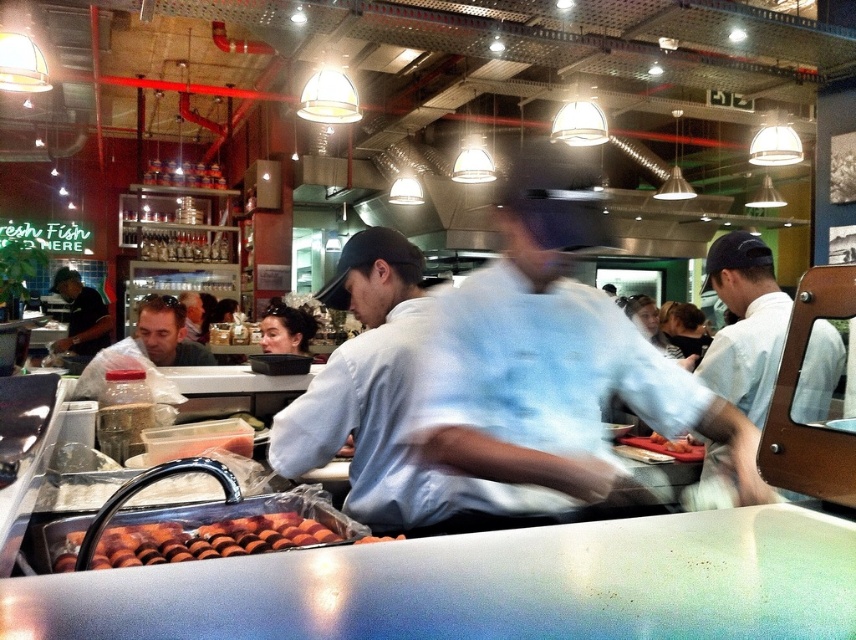
Question: Which point is farther from the camera taking this photo?

Choices:
 (A) (171, 332)
 (B) (100, 304)
 (C) (516, 356)
 (D) (54, 560)

Answer: (B)

Question: From the image, what is the correct spatial relationship of golden brown doughnuts at center in relation to matte black shirt at center?

Choices:
 (A) right
 (B) left

Answer: (A)

Question: Is matte black shirt at center to the left of smooth orange slices at center from the viewer's perspective?

Choices:
 (A) no
 (B) yes

Answer: (B)

Question: Based on their relative distances, which object is farther from the matte black shirt at center?

Choices:
 (A) white shirt at right
 (B) smooth orange slices at center
 (C) dark gray shirt at left

Answer: (C)

Question: Which point is farther to the camera?

Choices:
 (A) (361, 540)
 (B) (336, 538)

Answer: (B)

Question: Does matte black shirt at center appear on the right side of smooth orange slices at center?

Choices:
 (A) yes
 (B) no

Answer: (B)